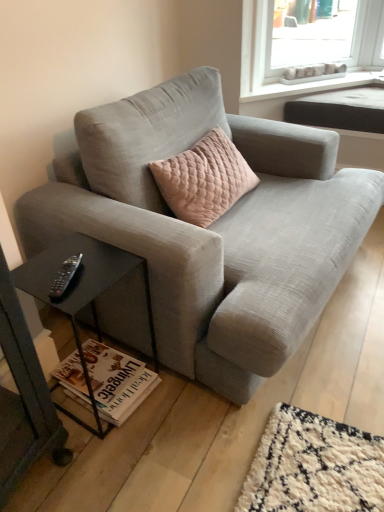
Question: Is white paper magazine at lower left facing towards light gray fabric couch at center?

Choices:
 (A) yes
 (B) no

Answer: (B)

Question: From a real-world perspective, is white paper magazine at lower left over light gray fabric couch at center?

Choices:
 (A) yes
 (B) no

Answer: (B)

Question: From a real-world perspective, is white paper magazine at lower left physically below light gray fabric couch at center?

Choices:
 (A) yes
 (B) no

Answer: (A)

Question: Does white paper magazine at lower left appear on the left side of light gray fabric couch at center?

Choices:
 (A) yes
 (B) no

Answer: (A)

Question: Is white paper magazine at lower left wider than light gray fabric couch at center?

Choices:
 (A) no
 (B) yes

Answer: (A)

Question: Does white paper magazine at lower left contain light gray fabric couch at center?

Choices:
 (A) no
 (B) yes

Answer: (A)

Question: Is light gray fabric couch at center at the right side of white plastic tray at upper right, which is the second window sill in front-to-back order?

Choices:
 (A) no
 (B) yes

Answer: (A)

Question: From a real-world perspective, is light gray fabric couch at center positioned over white plastic tray at upper right, which is counted as the first window sill, starting from the back, based on gravity?

Choices:
 (A) no
 (B) yes

Answer: (A)

Question: Is light gray fabric couch at center outside white plastic tray at upper right, which is the second window sill in front-to-back order?

Choices:
 (A) yes
 (B) no

Answer: (A)

Question: Is light gray fabric couch at center facing away from white plastic tray at upper right, which is the second window sill in front-to-back order?

Choices:
 (A) yes
 (B) no

Answer: (B)

Question: Is light gray fabric couch at center wider than white plastic tray at upper right, which is the second window sill in front-to-back order?

Choices:
 (A) yes
 (B) no

Answer: (A)

Question: Does light gray fabric couch at center have a lesser height compared to white plastic tray at upper right, which is counted as the first window sill, starting from the back?

Choices:
 (A) no
 (B) yes

Answer: (A)

Question: Is there a large distance between white plastic tray at upper right, which is the second window sill in front-to-back order, and black glass table at lower left?

Choices:
 (A) yes
 (B) no

Answer: (A)